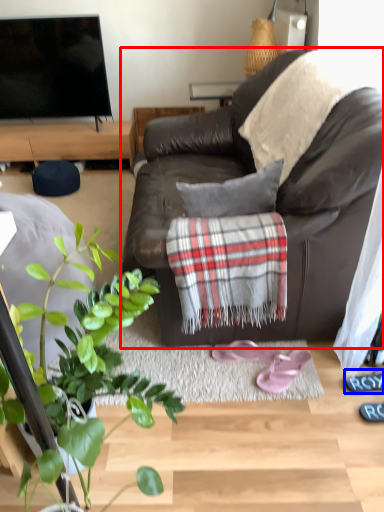
Question: Which of the following is the farthest to the observer, studio couch (highlighted by a red box) or shoe (highlighted by a blue box)?

Choices:
 (A) studio couch
 (B) shoe

Answer: (B)